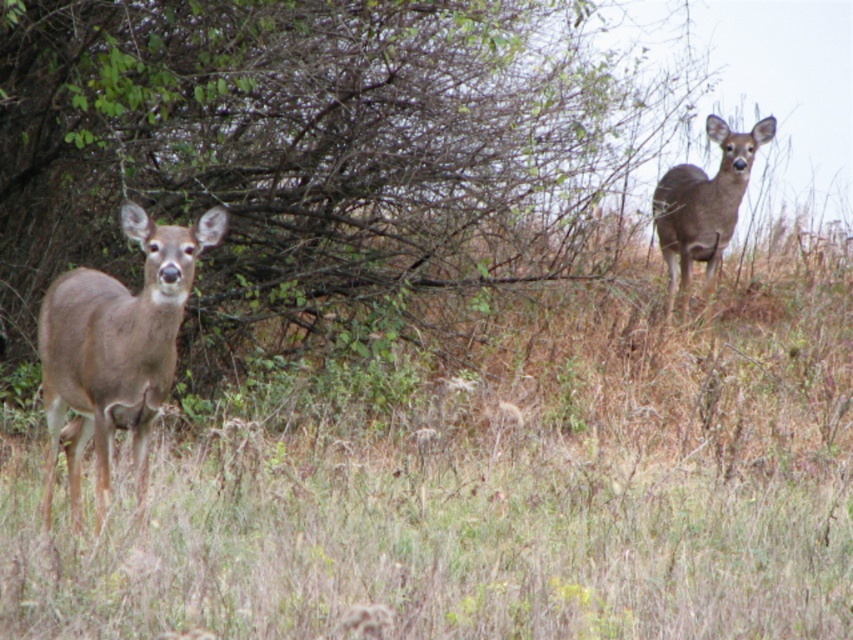
You are standing in the field and want to place a 10 foot long fence between you and the brown dry grass at center. Is the distance sufficient to accommodate the fence?

The distance between you and the brown dry grass at center is 24.43 feet, which is more than enough to place a 10 foot long fence between you and the brown dry grass at center.